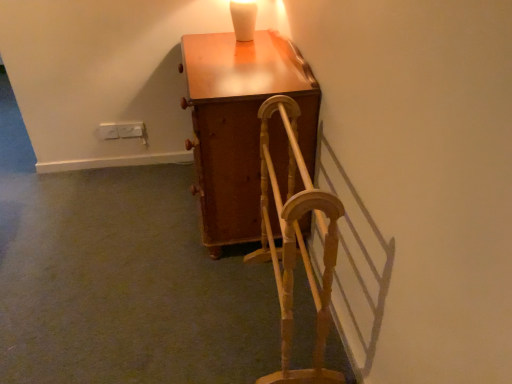
Question: From the image's perspective, is wooden cabinet at center positioned above or below wooden textured rocking chair at center?

Choices:
 (A) above
 (B) below

Answer: (A)

Question: From a real-world perspective, is wooden cabinet at center above or below wooden textured rocking chair at center?

Choices:
 (A) above
 (B) below

Answer: (A)

Question: In the image, is wooden cabinet at center on the left side or the right side of wooden textured rocking chair at center?

Choices:
 (A) left
 (B) right

Answer: (A)

Question: Based on their sizes in the image, would you say wooden textured rocking chair at center is bigger or smaller than wooden cabinet at center?

Choices:
 (A) small
 (B) big

Answer: (A)

Question: Is wooden textured rocking chair at center in front of or behind wooden cabinet at center in the image?

Choices:
 (A) behind
 (B) front

Answer: (B)

Question: Considering the relative positions of wooden textured rocking chair at center and wooden cabinet at center in the image provided, is wooden textured rocking chair at center to the left or to the right of wooden cabinet at center?

Choices:
 (A) left
 (B) right

Answer: (B)

Question: Is point (267, 155) positioned closer to the camera than point (306, 72)?

Choices:
 (A) closer
 (B) farther

Answer: (A)